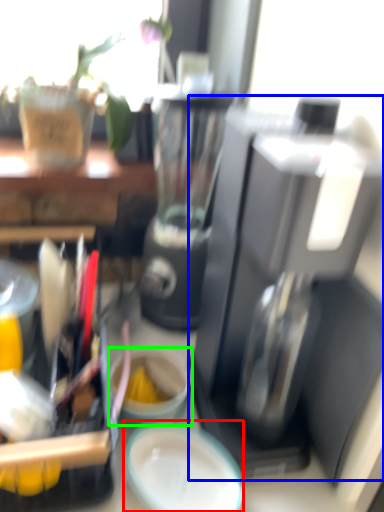
Question: Estimate the real-world distances between objects in this image. Which object is farther from plate (highlighted by a red box), coffee maker (highlighted by a blue box) or coffee cup (highlighted by a green box)?

Choices:
 (A) coffee maker
 (B) coffee cup

Answer: (A)